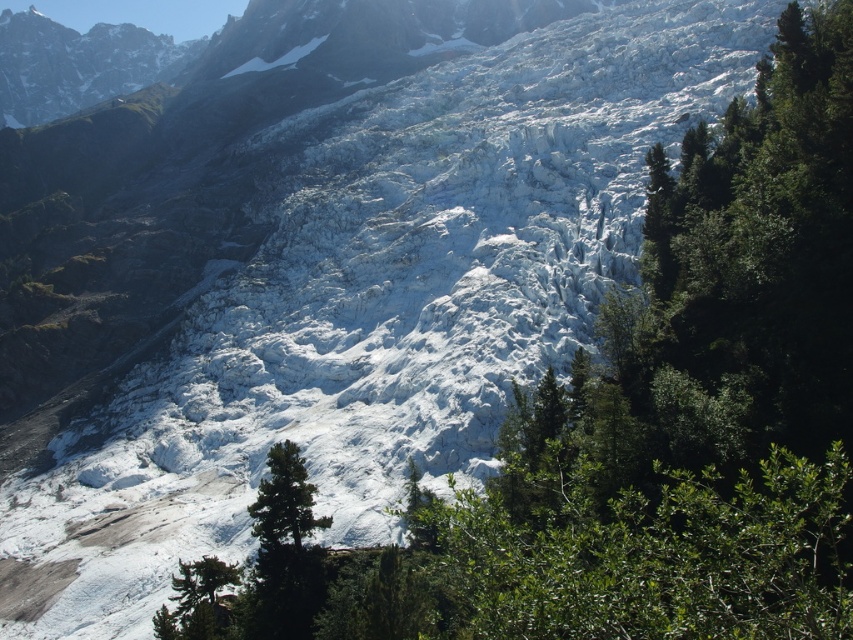
You are a hiker trying to navigate through the rocky terrain near the glacier. You see the green matte tree at center and the green textured tree at lower left. Which tree is closer to your current position if you are standing to the left of both trees?

The green textured tree at lower left is closer to your current position because you are standing to the left of both trees, and the green matte tree at center is to the right of the green textured tree at lower left.

You are standing at the origin point of the image. Which direction should you move to reach the green matte tree at center?

The green matte tree at center is located at point coordinates of 0.864 on the x axis and 0.333 on the y axis. Since the origin is at the bottom left corner of the image, you should move towards the upper right direction to reach the green matte tree at center.